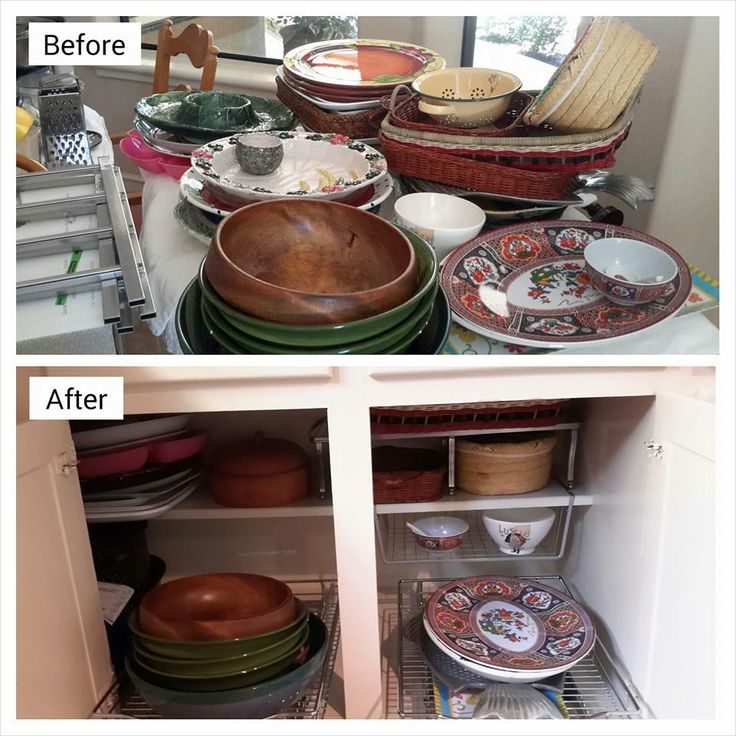
I want to click on dishrack, so click(421, 679).